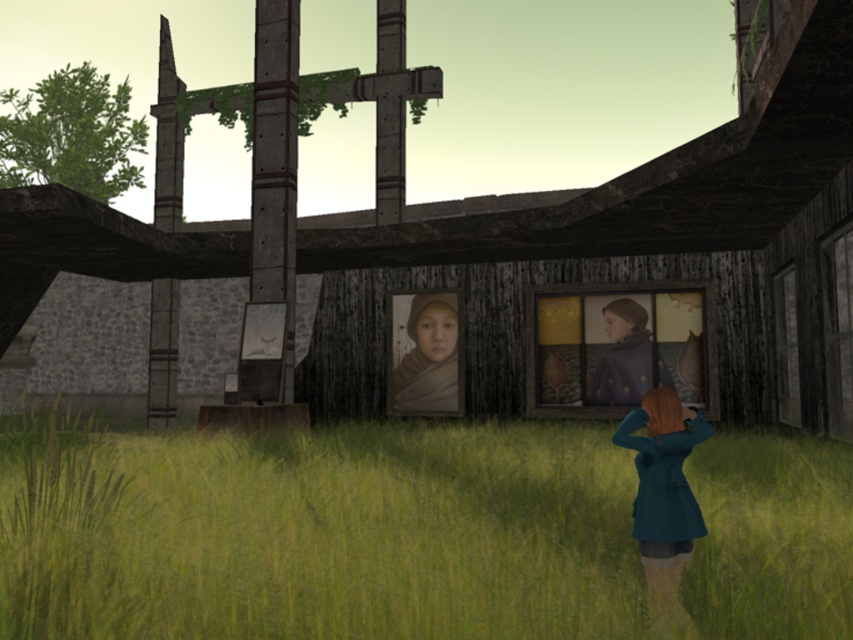
You are standing at the entrance of the abandoned building and see the green grass at lower left and the matte brown scarf at center. Which object is wider in the image?

The green grass at lower left might be wider than matte brown scarf at center according to the description.

You are a photographer trying to capture the figure in the teal coat and dark pants. To ensure the matte brown scarf at center is clearly visible in the photo, should you adjust your camera angle to avoid the green grass at lower left?

Yes, because the green grass at lower left is shorter than the matte brown scarf at center, so adjusting the angle could help highlight the scarf by avoiding the shorter grass in the foreground.

You are standing in the abandoned building and want to take a photo of the matte brown portrait at center without any green grass at lower left visible in the frame. How should you adjust your camera angle?

To avoid capturing the green grass at lower left, you should aim your camera upwards so that the matte brown portrait at center is framed above the green grass at lower left.